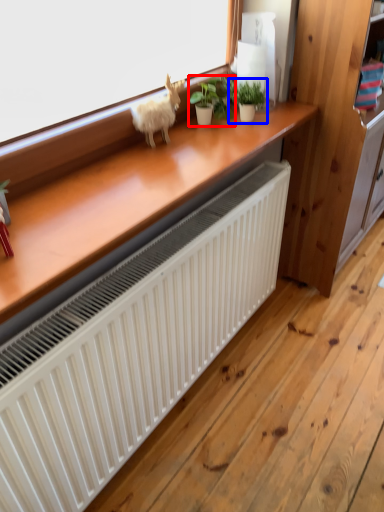
Question: Which of the following is the farthest to the observer, houseplant (highlighted by a red box) or houseplant (highlighted by a blue box)?

Choices:
 (A) houseplant
 (B) houseplant

Answer: (A)